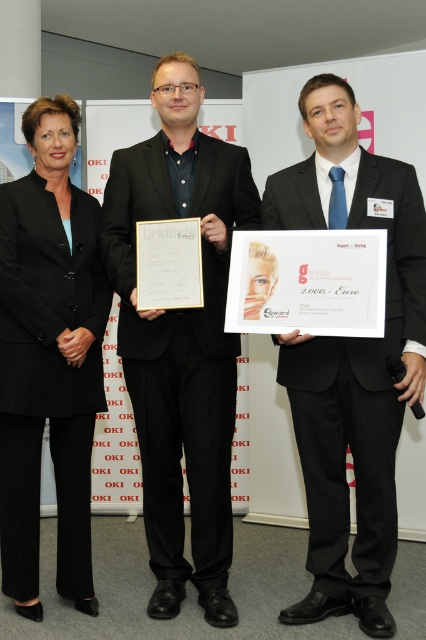
Can you confirm if black matte suit at center is wider than black suit at left?

Correct, the width of black matte suit at center exceeds that of black suit at left.

Find the location of a particular element. black matte suit at center is located at coordinates (181, 339).

Which is above, black matte suit at center or black glossy suit at center?

Positioned higher is black matte suit at center.

Can you confirm if black matte suit at center is positioned below black glossy suit at center?

No.

Is point (221, 621) closer to camera compared to point (419, 353)?

No, (221, 621) is behind (419, 353).

Image resolution: width=426 pixels, height=640 pixels. I want to click on black matte suit at center, so click(181, 339).

Can you confirm if black glossy suit at center is thinner than black suit at left?

Incorrect, black glossy suit at center's width is not less than black suit at left's.

Is point (316, 145) behind point (28, 397)?

Yes, point (316, 145) is behind point (28, 397).

This screenshot has width=426, height=640. What are the coordinates of `black glossy suit at center` in the screenshot? It's located at (351, 358).